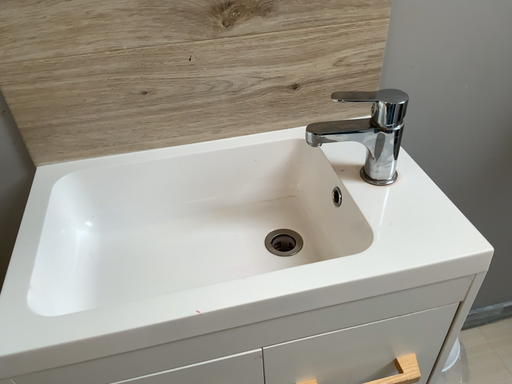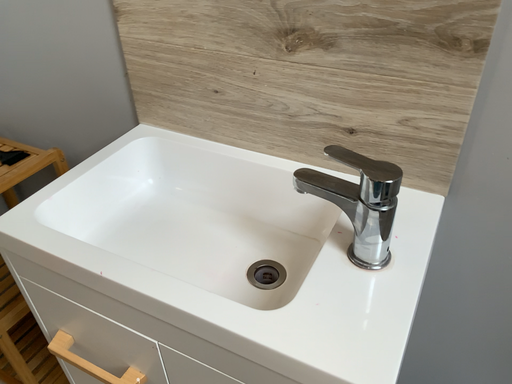
Question: How did the camera likely rotate when shooting the video?

Choices:
 (A) rotated downward
 (B) rotated upward

Answer: (B)